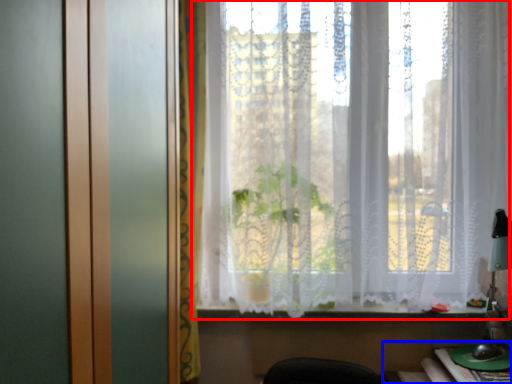
Question: Which object appears farthest to the camera in this image, curtain (highlighted by a red box) or table (highlighted by a blue box)?

Choices:
 (A) curtain
 (B) table

Answer: (A)